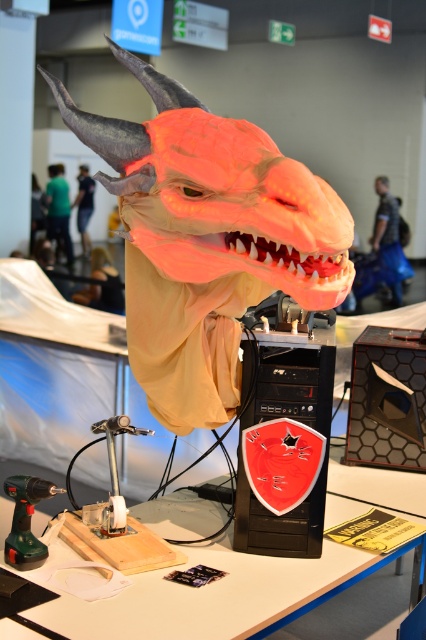
You are standing in front of the dragon head sculpture at the gamescom exhibition. You notice two points marked on the sculpture. One is at coordinate point (6, 536) and the other at point (385, 195). Which point is closer to you?

Point (6, 536) is closer to the camera than point (385, 195), so the point at coordinate point (6, 536) is closer to you.

Consider the image. You are a photographer standing at the point marked by the coordinate point at point (314, 611). You want to take a photo of the dragon head sculpture. The dragon head is 2.87 meters away from your current position. Is the dragon head sculpture within your camera lens range if your camera can focus up to 3 meters?

The dragon head sculpture is 2.87 meters away from the photographer at point (314, 611). Since the camera can focus up to 3 meters, the dragon head sculpture is within the camera lens range.